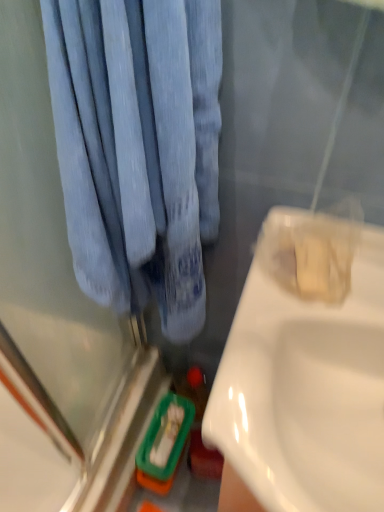
Question: Is white glossy sink at right smaller than blue fabric curtain at upper left?

Choices:
 (A) yes
 (B) no

Answer: (B)

Question: Does white glossy sink at right turn towards blue fabric curtain at upper left?

Choices:
 (A) no
 (B) yes

Answer: (A)

Question: Is the depth of white glossy sink at right less than that of blue fabric curtain at upper left?

Choices:
 (A) no
 (B) yes

Answer: (A)

Question: Considering the relative sizes of white glossy sink at right and blue fabric curtain at upper left in the image provided, is white glossy sink at right shorter than blue fabric curtain at upper left?

Choices:
 (A) yes
 (B) no

Answer: (B)

Question: From a real-world perspective, is white glossy sink at right positioned over blue fabric curtain at upper left based on gravity?

Choices:
 (A) no
 (B) yes

Answer: (A)

Question: Can we say white glossy sink at right lies outside blue fabric curtain at upper left?

Choices:
 (A) yes
 (B) no

Answer: (A)

Question: Is blue fabric curtain at upper left positioned with its back to white glossy sink at right?

Choices:
 (A) yes
 (B) no

Answer: (B)

Question: Is the depth of blue fabric curtain at upper left greater than that of white glossy sink at right?

Choices:
 (A) yes
 (B) no

Answer: (B)

Question: Is blue fabric curtain at upper left bigger than white glossy sink at right?

Choices:
 (A) no
 (B) yes

Answer: (A)

Question: Is blue fabric curtain at upper left taller than white glossy sink at right?

Choices:
 (A) no
 (B) yes

Answer: (A)

Question: From a real-world perspective, is blue fabric curtain at upper left located beneath white glossy sink at right?

Choices:
 (A) no
 (B) yes

Answer: (A)

Question: Does blue fabric curtain at upper left have a lesser height compared to white glossy sink at right?

Choices:
 (A) yes
 (B) no

Answer: (A)

Question: Based on their sizes in the image, would you say white glossy sink at right is bigger or smaller than blue fabric curtain at upper left?

Choices:
 (A) small
 (B) big

Answer: (B)